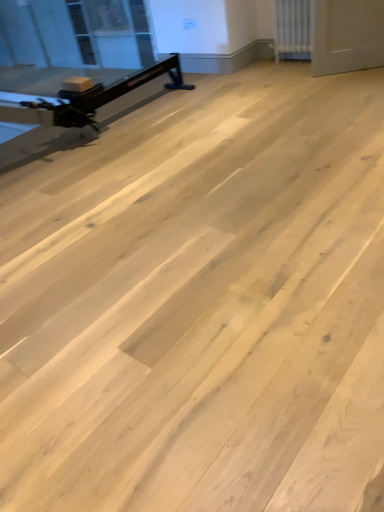
Question: Can you confirm if white textured radiator at upper right is taller than transparent glass window screen at upper left?

Choices:
 (A) yes
 (B) no

Answer: (B)

Question: Does white textured radiator at upper right lie behind transparent glass window screen at upper left?

Choices:
 (A) yes
 (B) no

Answer: (B)

Question: From a real-world perspective, is white textured radiator at upper right physically below transparent glass window screen at upper left?

Choices:
 (A) yes
 (B) no

Answer: (B)

Question: Could you tell me if white textured radiator at upper right is turned towards transparent glass window screen at upper left?

Choices:
 (A) yes
 (B) no

Answer: (B)

Question: Is transparent glass window screen at upper left surrounded by white textured radiator at upper right?

Choices:
 (A) yes
 (B) no

Answer: (B)

Question: Is matte black exercise bike at left bigger or smaller than white textured radiator at upper right?

Choices:
 (A) big
 (B) small

Answer: (B)

Question: Considering their positions, is matte black exercise bike at left located in front of or behind white textured radiator at upper right?

Choices:
 (A) front
 (B) behind

Answer: (A)

Question: Is point (34, 112) positioned closer to the camera than point (289, 0)?

Choices:
 (A) farther
 (B) closer

Answer: (B)

Question: Considering the relative positions of matte black exercise bike at left and white textured radiator at upper right in the image provided, is matte black exercise bike at left to the left or to the right of white textured radiator at upper right?

Choices:
 (A) right
 (B) left

Answer: (B)

Question: Is point (307, 10) closer or farther from the camera than point (77, 120)?

Choices:
 (A) closer
 (B) farther

Answer: (B)

Question: Would you say white textured radiator at upper right is inside or outside matte black exercise bike at left?

Choices:
 (A) inside
 (B) outside

Answer: (B)

Question: Looking at their shapes, would you say white textured radiator at upper right is wider or thinner than matte black exercise bike at left?

Choices:
 (A) thin
 (B) wide

Answer: (B)

Question: Looking at the image, does white textured radiator at upper right seem bigger or smaller compared to matte black exercise bike at left?

Choices:
 (A) big
 (B) small

Answer: (A)

Question: In terms of size, does transparent glass window screen at upper left appear bigger or smaller than white textured radiator at upper right?

Choices:
 (A) small
 (B) big

Answer: (B)

Question: Is transparent glass window screen at upper left spatially inside white textured radiator at upper right, or outside of it?

Choices:
 (A) inside
 (B) outside

Answer: (B)